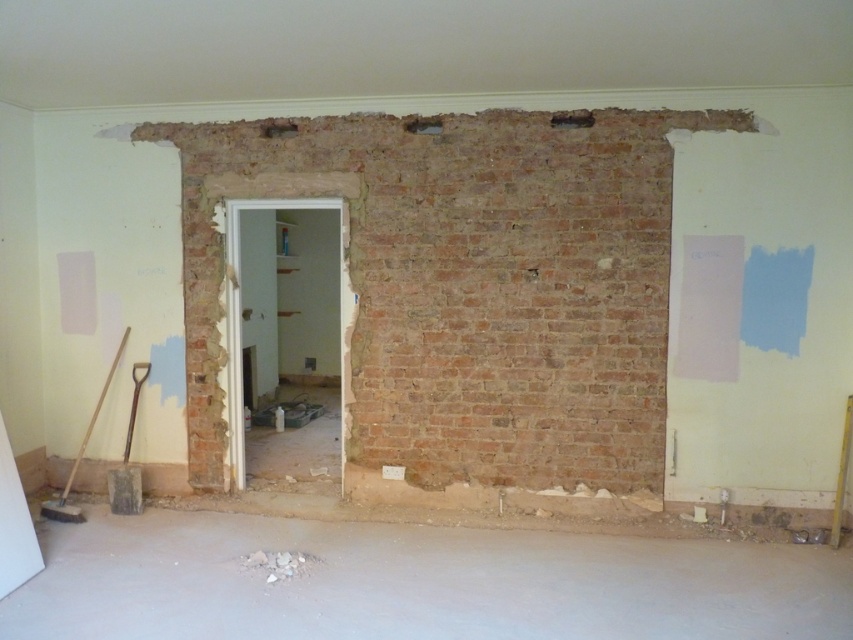
Question: Which object appears closest to the camera in this image?

Choices:
 (A) brick wall hole at upper center
 (B) crumbly concrete debris at lower center
 (C) smooth concrete hole at center

Answer: (B)

Question: In this image, where is brick wall hole at upper center located relative to smooth concrete hole at center?

Choices:
 (A) below
 (B) above

Answer: (A)

Question: Which point is farther to the camera?

Choices:
 (A) (286, 573)
 (B) (567, 122)

Answer: (B)

Question: Where is crumbly concrete debris at lower center located in relation to smooth concrete hole at center in the image?

Choices:
 (A) right
 (B) left

Answer: (B)

Question: Which is nearer to the crumbly concrete debris at lower center?

Choices:
 (A) smooth concrete hole at center
 (B) brick wall hole at upper center

Answer: (A)

Question: Does crumbly concrete debris at lower center appear on the right side of smooth concrete hole at center?

Choices:
 (A) no
 (B) yes

Answer: (A)